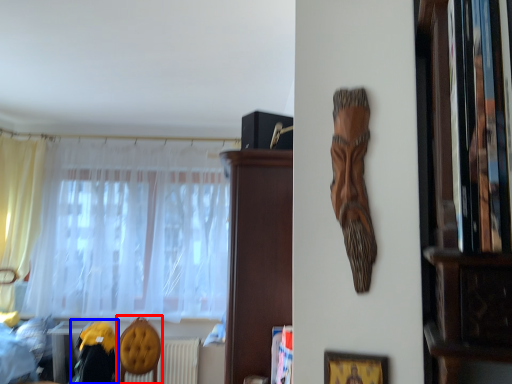
Question: Which of the following is the closest to the observer, armchair (highlighted by a red box) or swivel chair (highlighted by a blue box)?

Choices:
 (A) armchair
 (B) swivel chair

Answer: (B)